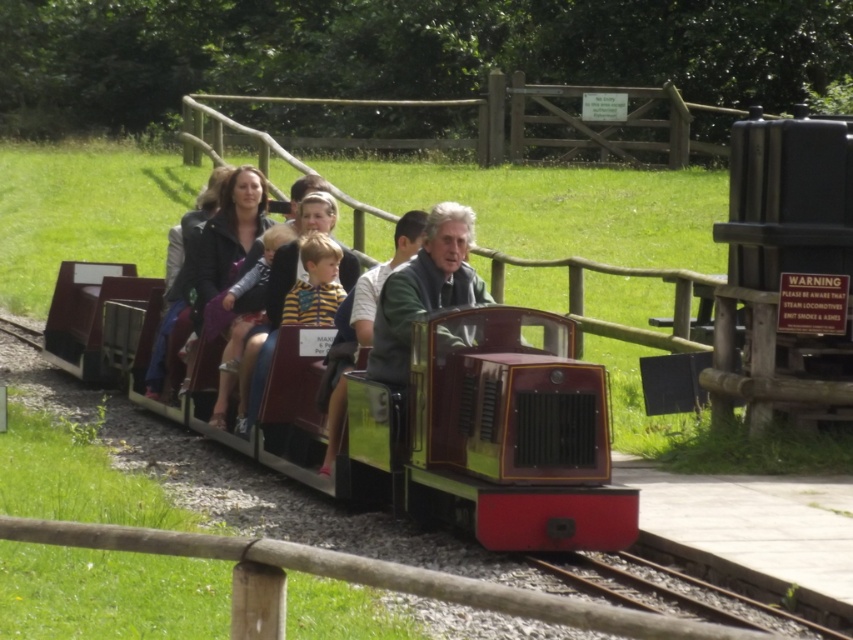
Between matte black train car at center and yellow striped sweater at center, which one is positioned higher?

yellow striped sweater at center is higher up.

Is matte black train car at center wider than yellow striped sweater at center?

Incorrect, matte black train car at center's width does not surpass yellow striped sweater at center's.

Does point (398, 230) come in front of point (332, 240)?

Yes, point (398, 230) is in front of point (332, 240).

Where is `matte black train car at center`? Image resolution: width=853 pixels, height=640 pixels. matte black train car at center is located at coordinates (386, 273).

Is point (554, 564) in front of point (296, 316)?

Yes, it is.

Which is more to the left, metallic train track at lower center or yellow striped sweater at center?

Positioned to the left is yellow striped sweater at center.

Where is `metallic train track at lower center`? metallic train track at lower center is located at coordinates (672, 592).

Between point (495, 586) and point (294, 321), which one is positioned behind?

The point (294, 321) is more distant.

Between metal rail at lower center and yellow striped sweater at center, which one appears on the left side from the viewer's perspective?

From the viewer's perspective, yellow striped sweater at center appears more on the left side.

You are a GUI agent. You are given a task and a screenshot of the screen. Output one action in this format:
    pyautogui.click(x=<x>, y=<y>)
    Task: Click on the metal rail at lower center
    This screenshot has height=640, width=853.
    Given the screenshot: What is the action you would take?
    pyautogui.click(x=357, y=579)